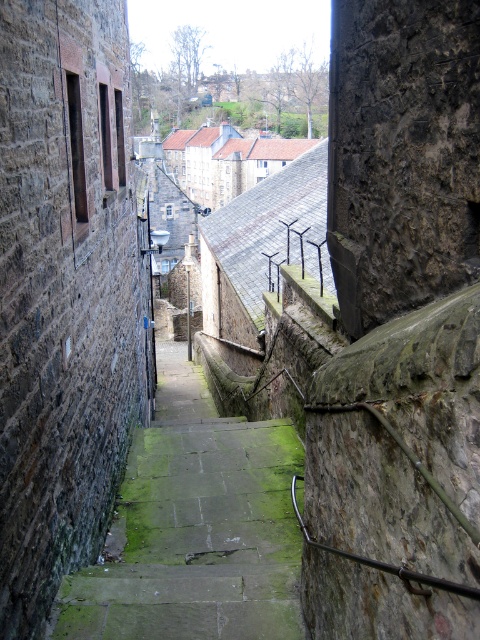
You are standing at the top of the narrow stone staircase and want to descend carefully. The point marked as (x=194, y=528) on the image is where you need to step. What kind of surface will you be stepping onto?

The point marked as (x=194, y=528) corresponds to green mossy stone steps at center, so stepping there will place your foot on a mossy stone surface which may be slippery due to the moss growth.

You are a delivery person carrying a large package and need to walk down the narrow stone staircase. The package is 1.2 meters wide. Can you safely navigate the staircase while holding the package? Consider the width of the green mossy stone steps at center and the brown wooden window at upper left in your answer.

The green mossy stone steps at center are wider than the brown wooden window at upper left. Since the steps are wider, the 1.2 meter wide package should fit as you descend, provided you stay centered on the steps and avoid the narrower window area.

You are a delivery person carrying a heavy package and need to descend the narrow stone staircase. You notice the green mossy stone steps at center and the brown wooden window at upper left. Which object would you need to avoid slipping on?

The green mossy stone steps at center have a larger size compared to the brown wooden window at upper left, so you should avoid slipping on the green mossy stone steps at center as they are more likely to be slippery due to the moss covering them.